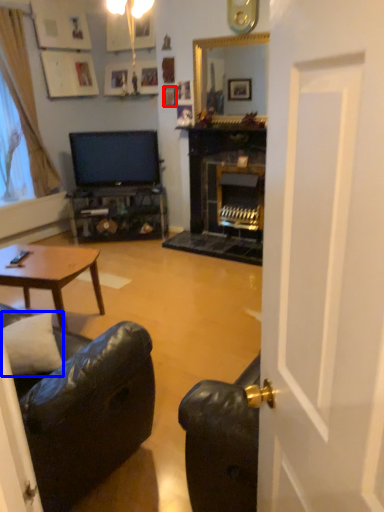
Question: Which object is further to the camera taking this photo, picture frame (highlighted by a red box) or pillow (highlighted by a blue box)?

Choices:
 (A) picture frame
 (B) pillow

Answer: (A)